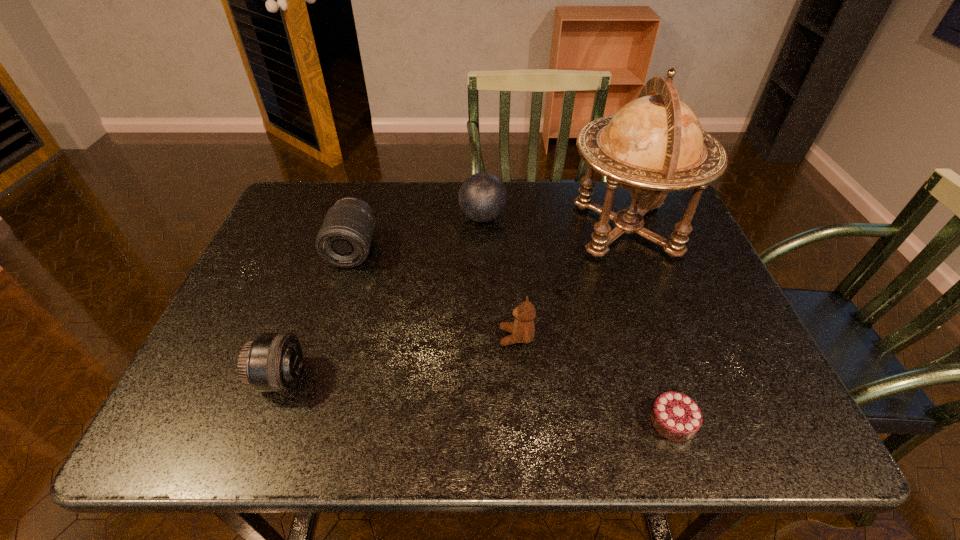
You are a GUI agent. You are given a task and a screenshot of the screen. Output one action in this format:
    pyautogui.click(x=<x>, y=<y>)
    Task: Click on the vacant space at the far left corner
    The image size is (960, 540).
    Given the screenshot: What is the action you would take?
    pyautogui.click(x=300, y=210)

This screenshot has width=960, height=540. Find the location of `free space at the near left corner of the desktop`. free space at the near left corner of the desktop is located at coordinates (201, 438).

The width and height of the screenshot is (960, 540). In the image, there is a desktop. Find the location of `free region at the far right corner`. free region at the far right corner is located at coordinates (661, 217).

The height and width of the screenshot is (540, 960). In the image, there is a desktop. What are the coordinates of `vacant area at the near right corner` in the screenshot? It's located at (743, 419).

Find the location of `vacant area that lies between the bowling ball and the chocolate cake`. vacant area that lies between the bowling ball and the chocolate cake is located at coordinates (578, 319).

Image resolution: width=960 pixels, height=540 pixels. Find the location of `free space between the tallest object and the teddy bear`. free space between the tallest object and the teddy bear is located at coordinates (571, 283).

I want to click on vacant area that lies between the nearer telephoto lens and the teddy bear, so click(x=398, y=357).

You are a GUI agent. You are given a task and a screenshot of the screen. Output one action in this format:
    pyautogui.click(x=<x>, y=<y>)
    Task: Click on the vacant area that lies between the farther telephoto lens and the teddy bear
    This screenshot has width=960, height=540.
    Given the screenshot: What is the action you would take?
    (435, 293)

You are a GUI agent. You are given a task and a screenshot of the screen. Output one action in this format:
    pyautogui.click(x=<x>, y=<y>)
    Task: Click on the free space between the nearer telephoto lens and the third nearest object
    
    Given the screenshot: What is the action you would take?
    pyautogui.click(x=398, y=357)

I want to click on vacant area that lies between the farther telephoto lens and the fourth farthest object, so click(435, 293).